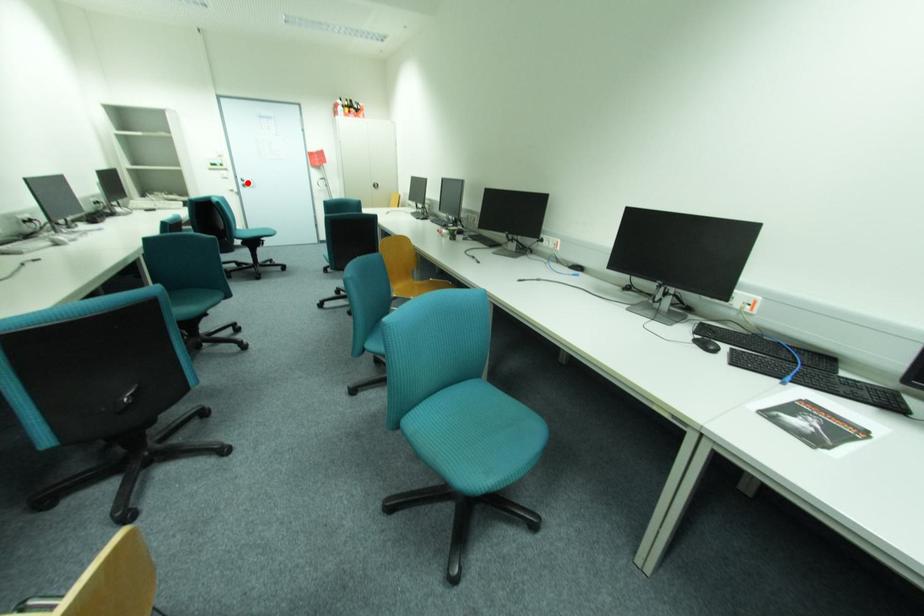
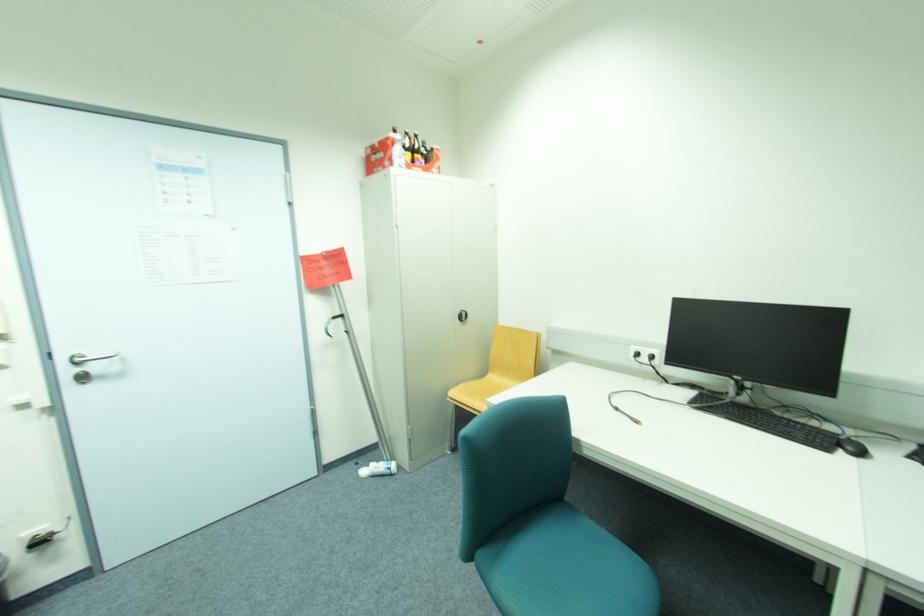
Question: I am providing you with two images of the same scene from different viewpoints. A red point is shown in image1. For the corresponding object point in image2, is it positioned nearer or farther from the camera?

Choices:
 (A) Nearer
 (B) Farther

Answer: (B)